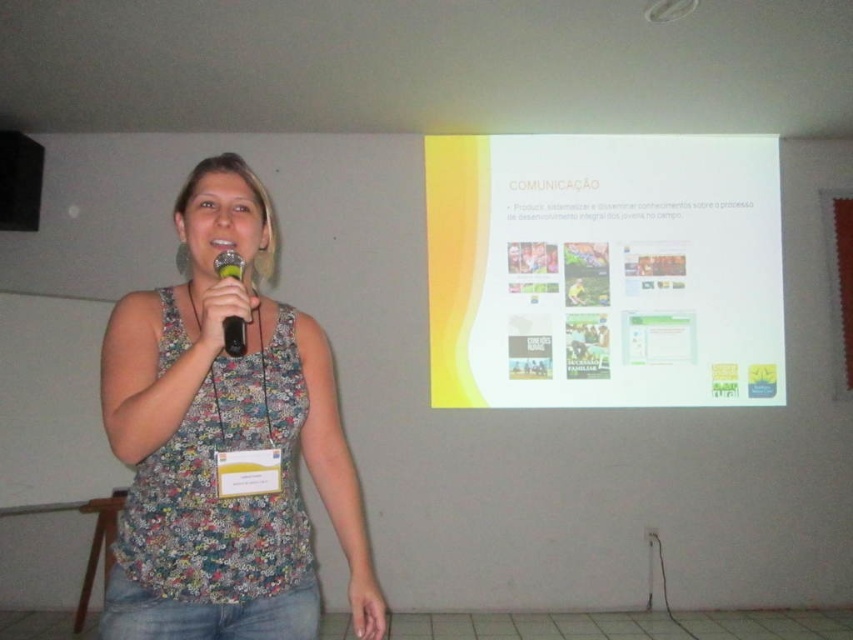
Which of these two, yellow matte projector screen at upper center or matte black microphone at center, stands shorter?

matte black microphone at center

Which is behind, point (587, 273) or point (238, 276)?

Point (587, 273)

Image resolution: width=853 pixels, height=640 pixels. I want to click on yellow matte projector screen at upper center, so click(604, 269).

Which is more to the right, floral fabric tank top at center or matte black microphone at center?

From the viewer's perspective, matte black microphone at center appears more on the right side.

Does point (175, 365) lie in front of point (242, 353)?

No, (175, 365) is behind (242, 353).

The height and width of the screenshot is (640, 853). What are the coordinates of `floral fabric tank top at center` in the screenshot? It's located at (225, 442).

This screenshot has height=640, width=853. Find the location of `yellow matte projector screen at upper center`. yellow matte projector screen at upper center is located at coordinates (604, 269).

Does yellow matte projector screen at upper center lie behind floral fabric tank top at center?

Yes, yellow matte projector screen at upper center is behind floral fabric tank top at center.

Which is behind, point (466, 163) or point (253, 509)?

Positioned behind is point (466, 163).

You are a GUI agent. You are given a task and a screenshot of the screen. Output one action in this format:
    pyautogui.click(x=<x>, y=<y>)
    Task: Click on the yellow matte projector screen at upper center
    The height and width of the screenshot is (640, 853).
    Given the screenshot: What is the action you would take?
    pyautogui.click(x=604, y=269)